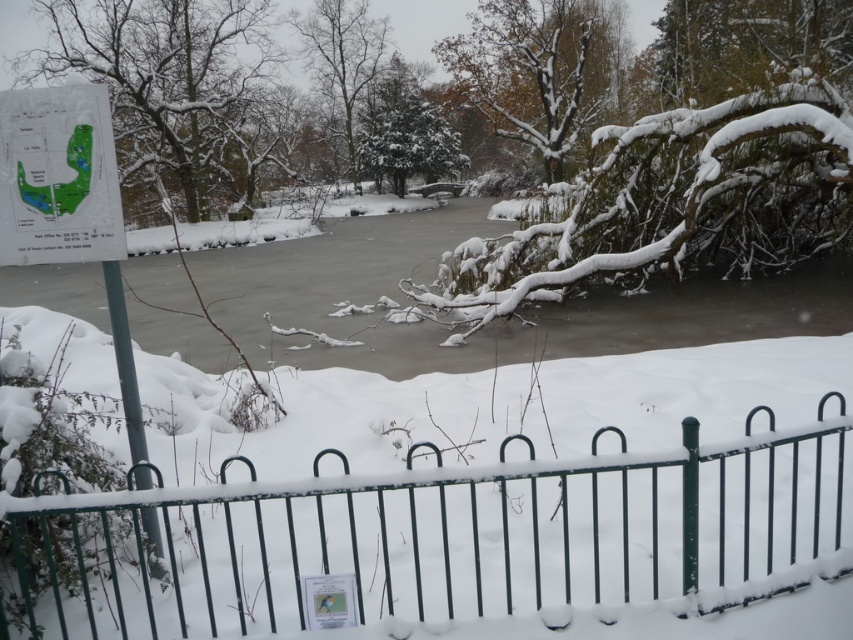
Question: Which point is closer to the camera taking this photo?

Choices:
 (A) tap(83, 212)
 (B) tap(397, 72)
 (C) tap(86, 58)
 (D) tap(660, 342)

Answer: (A)

Question: Which object is positioned closest to the green leafy tree at upper left?

Choices:
 (A) green textured evergreen tree at center
 (B) green textured tree at upper center
 (C) green paper map at upper left
 (D) snow-covered tree at upper center

Answer: (D)

Question: Does green paper map at upper left have a larger size compared to green textured evergreen tree at center?

Choices:
 (A) yes
 (B) no

Answer: (A)

Question: Does snow-covered metal fence at lower center appear on the left side of green textured evergreen tree at center?

Choices:
 (A) no
 (B) yes

Answer: (A)

Question: Does green paper map at upper left have a greater width compared to green textured evergreen tree at center?

Choices:
 (A) no
 (B) yes

Answer: (B)

Question: Which of the following is the farthest from the observer?

Choices:
 (A) frozen ice at center
 (B) green leafy tree at upper left
 (C) snow-covered tree at upper center
 (D) snow-covered metal fence at lower center

Answer: (C)